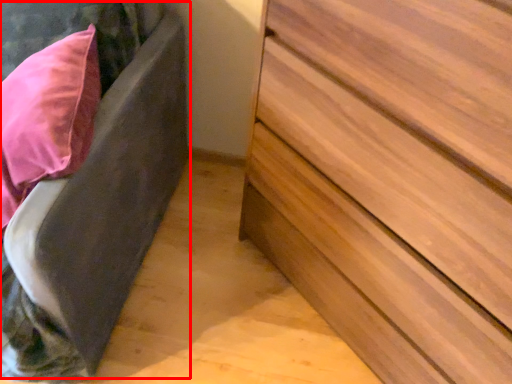
Question: Observing the image, what is the correct spatial positioning of bed frame (annotated by the red box) in reference to chest of drawers?

Choices:
 (A) left
 (B) right

Answer: (A)